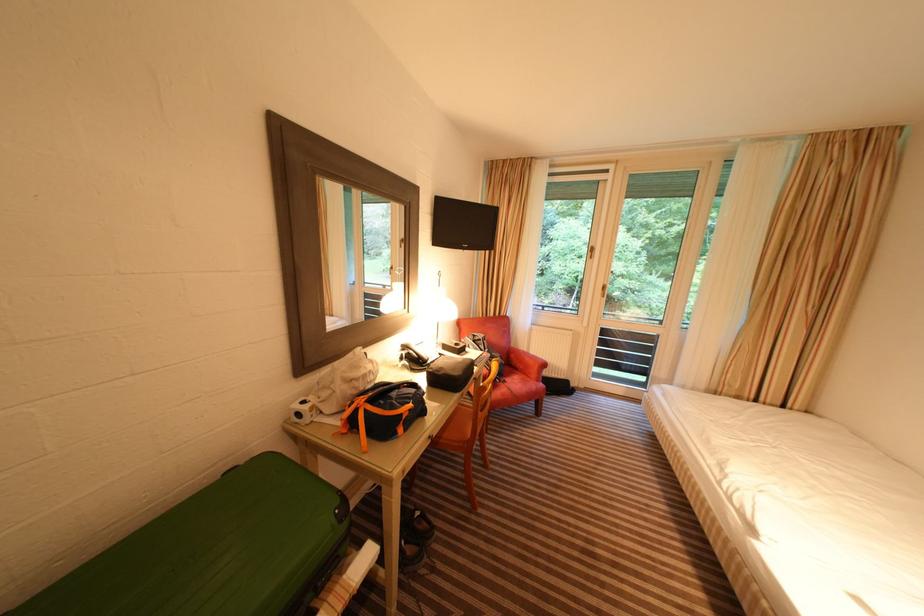
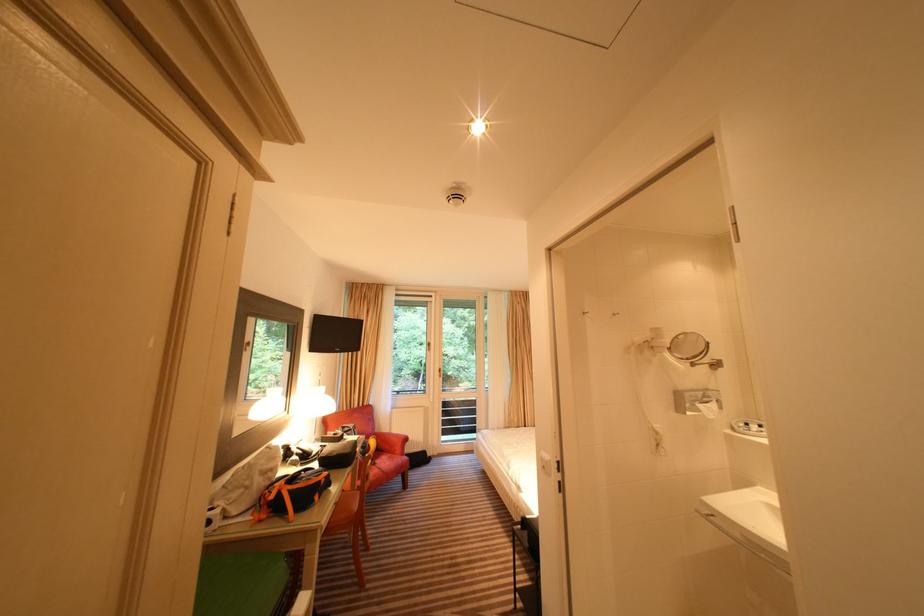
Based on the continuous images, in which direction is the camera rotating?

The rotation direction of the camera is right-up.